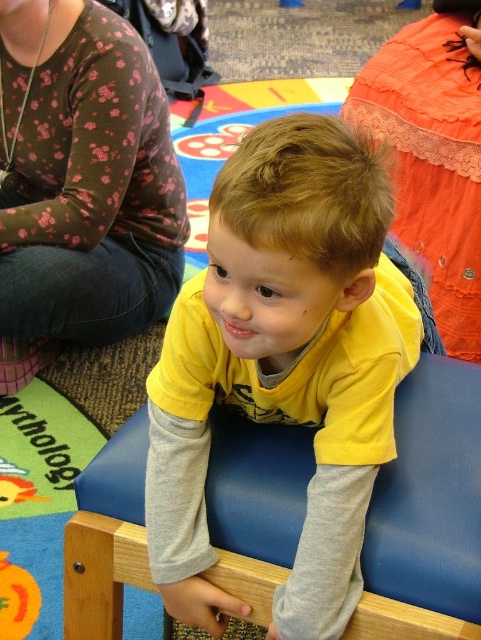
Based on the photo, you are standing in the classroom and see two points marked on the wall. The first point is at coordinate point(361, 196) and the second point is at coordinate point(458, 163). Which point is closer to you?

Point(361, 196) is in front of point(458, 163), so it is closer to you.

You are designing a layout for a small room and need to place both the floral print sweater at upper left and the wooden chair at center. Given their sizes, which object should you consider placing first to ensure they both fit comfortably?

Since the floral print sweater at upper left is narrower than the wooden chair at center, you should place the wooden chair at center first to account for its larger size, ensuring there is enough space left for the floral print sweater at upper left.

You are taking a photo of two points in the image. The first point is at coordinates point (88, 200) and the second is at point (92, 496). Which point should you focus on to ensure it appears clearer in the photo?

Point (88, 200) should be focused on because it is closer to the camera than point (92, 496), so focusing on it will make it clearer in the photo.